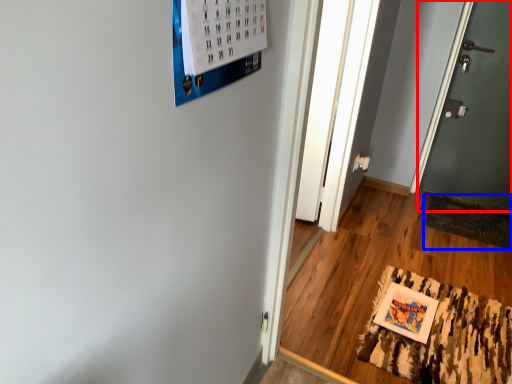
Question: Which object is closer to the camera taking this photo, door (highlighted by a red box) or doormat (highlighted by a blue box)?

Choices:
 (A) door
 (B) doormat

Answer: (A)